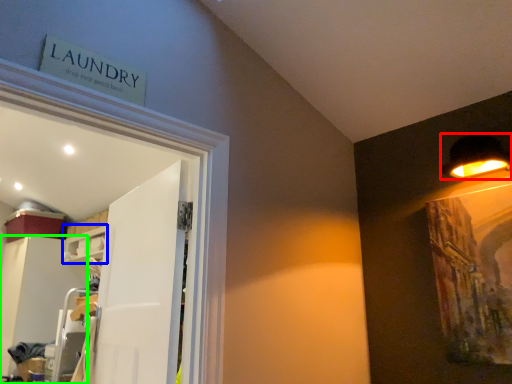
Question: Which object is positioned farthest from lamp (highlighted by a red box)? Select from shelf (highlighted by a blue box) and cabinetry (highlighted by a green box).

Choices:
 (A) shelf
 (B) cabinetry

Answer: (B)